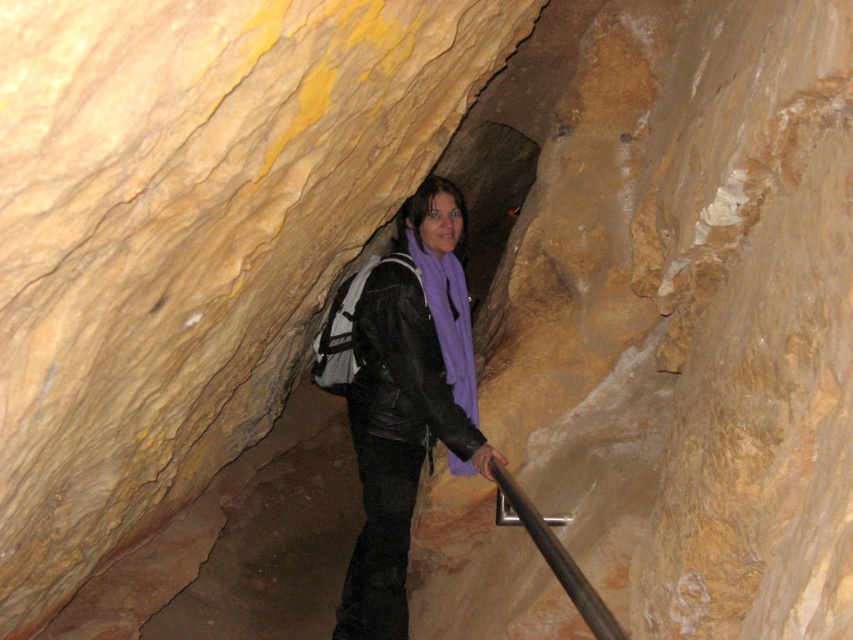
Who is lower down, purple matte scarf at center or black leather jacket at center?

purple matte scarf at center is below.

At what (x,y) coordinates should I click in order to perform the action: click on purple matte scarf at center. Please return your answer as a coordinate pair (x, y). Looking at the image, I should click on pos(401,394).

This screenshot has width=853, height=640. What do you see at coordinates (410, 356) in the screenshot? I see `black leather jacket at center` at bounding box center [410, 356].

Does black leather jacket at center appear under black metal rail at center?

Incorrect, black leather jacket at center is not positioned below black metal rail at center.

The image size is (853, 640). Identify the location of black leather jacket at center. (410, 356).

Does purple matte scarf at center appear over black metal rail at center?

Correct, purple matte scarf at center is located above black metal rail at center.

Between point (376, 632) and point (607, 624), which one is positioned behind?

The point (376, 632) is behind.

Find the location of a particular element. purple matte scarf at center is located at coordinates (401, 394).